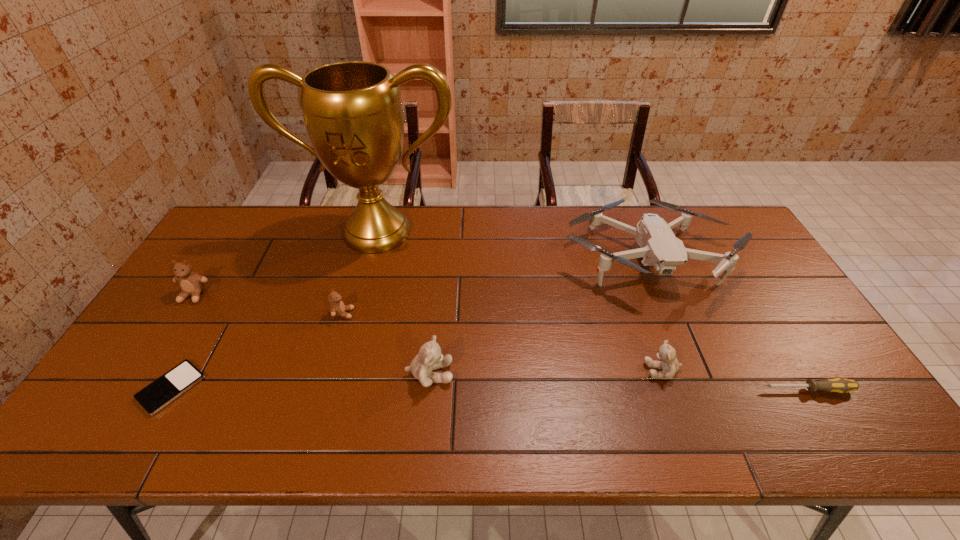
The height and width of the screenshot is (540, 960). Identify the location of gold trophy cup. (352, 110).

Image resolution: width=960 pixels, height=540 pixels. I want to click on the tallest object, so click(x=352, y=110).

Locate an element on the screen. drone is located at coordinates 660,248.

Find the location of a particular element. the bigger brown teddy bear is located at coordinates (191, 284).

Identify the location of the left brown teddy bear. (191, 284).

Find the location of a particular element. the bigger gray teddy bear is located at coordinates (430, 357).

Image resolution: width=960 pixels, height=540 pixels. In order to click on the second teddy bear from right to left in this screenshot , I will do `click(430, 357)`.

Locate an element on the screen. the third teddy bear from right to left is located at coordinates (337, 308).

This screenshot has width=960, height=540. In order to click on the smaller brown teddy bear in this screenshot , I will do `click(337, 308)`.

Image resolution: width=960 pixels, height=540 pixels. I want to click on the rightmost teddy bear, so click(x=667, y=354).